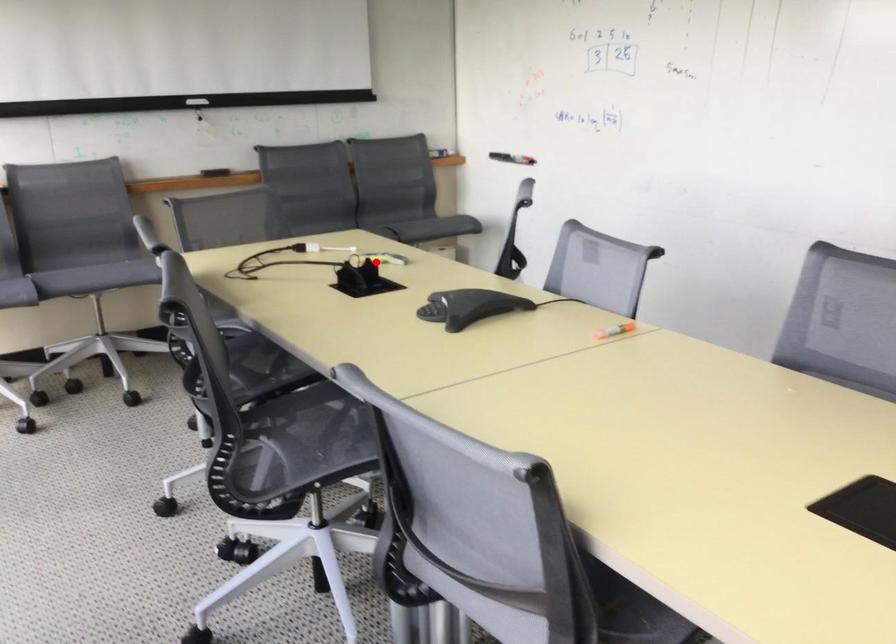
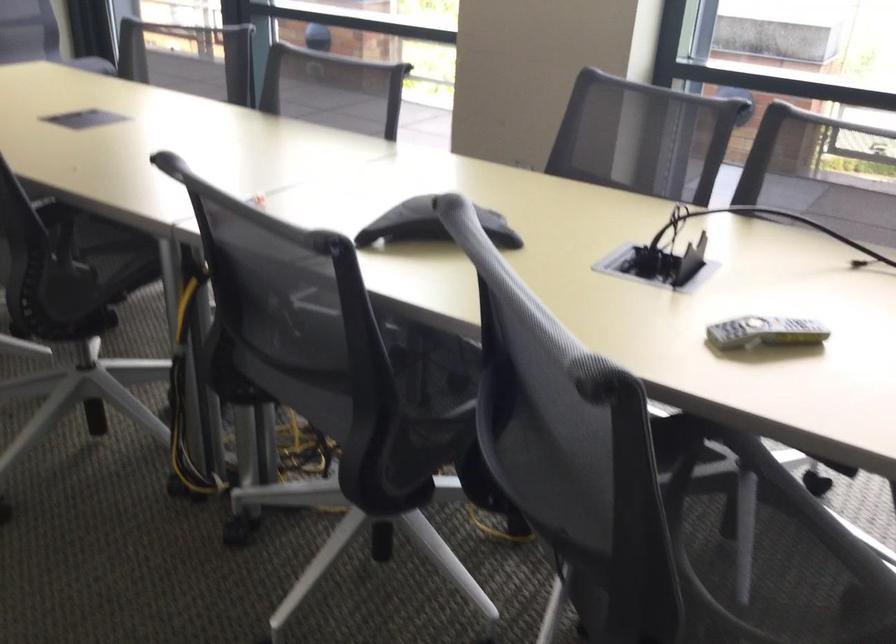
Question: I am providing you with two images of the same scene from different viewpoints. A red point is marked on the first image. At the location where the point appears in image 1, is it still visible in image 2?

Choices:
 (A) Yes
 (B) No

Answer: (A)